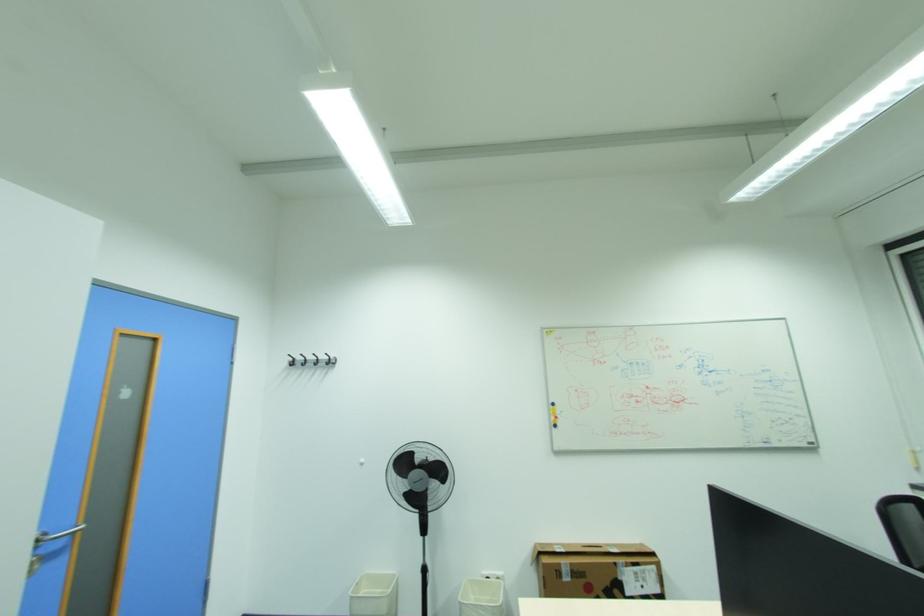
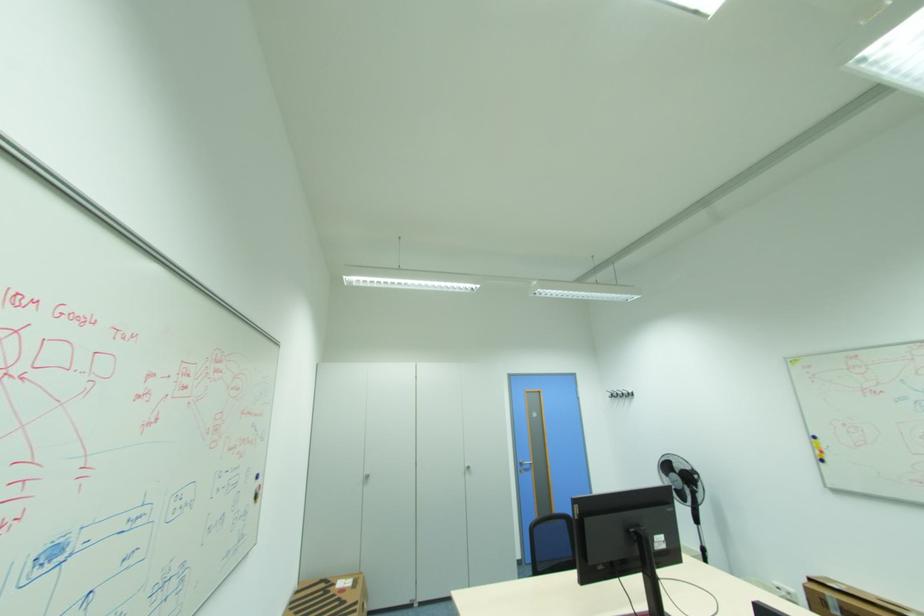
Locate, in the second image, the point that corresponds to [558,419] in the first image.

(822, 453)